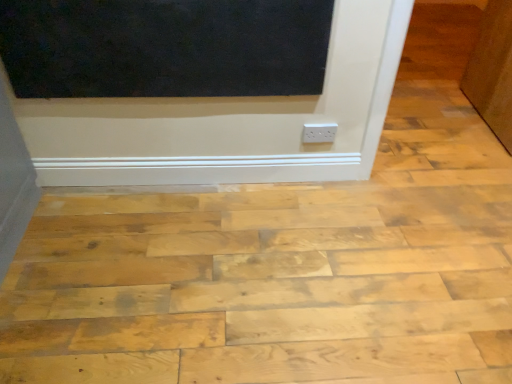
Find the location of a particular element. vacant space underneath brown matte door at upper right (from a real-world perspective) is located at coordinates (473, 115).